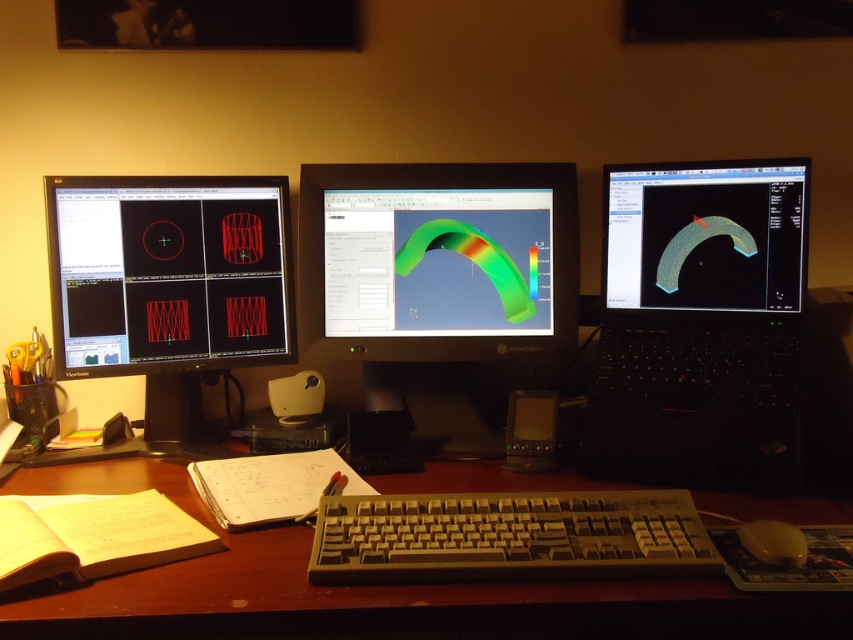
Based on the photo, measure the distance from brown wood table at center to beige plastic keyboard at center.

3.94 inches

Consider the image. Can you confirm if brown wood table at center is bigger than beige plastic keyboard at center?

Indeed, brown wood table at center has a larger size compared to beige plastic keyboard at center.

Is point (80, 474) positioned after point (569, 496)?

Yes, it is behind point (569, 496).

Locate an element on the screen. The height and width of the screenshot is (640, 853). brown wood table at center is located at coordinates (367, 589).

The width and height of the screenshot is (853, 640). Find the location of `green matte monitor at center`. green matte monitor at center is located at coordinates (438, 280).

Is green matte monitor at center to the left of white plastic mouse at lower right from the viewer's perspective?

Yes, green matte monitor at center is to the left of white plastic mouse at lower right.

Find the location of a particular element. The width and height of the screenshot is (853, 640). green matte monitor at center is located at coordinates (438, 280).

Between point (732, 417) and point (465, 266), which one is positioned in front?

Point (732, 417) is in front.

Between black glossy laptop at right and green matte monitor at center, which one has less height?

green matte monitor at center is shorter.

I want to click on black glossy laptop at right, so click(x=700, y=324).

This screenshot has width=853, height=640. What are the coordinates of `black glossy laptop at right` in the screenshot? It's located at (700, 324).